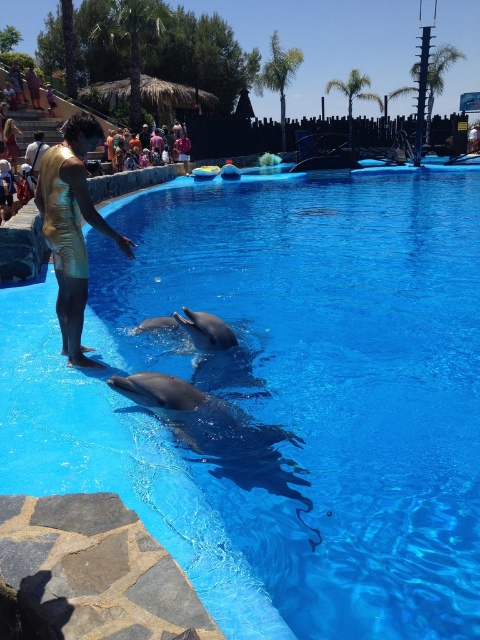
The height and width of the screenshot is (640, 480). What do you see at coordinates (216, 353) in the screenshot?
I see `gray smooth dolphin at center` at bounding box center [216, 353].

In the scene shown: Who is shorter, gray smooth dolphin at center or multicolored fabric crowd at upper center?

gray smooth dolphin at center

You are a GUI agent. You are given a task and a screenshot of the screen. Output one action in this format:
    pyautogui.click(x=<x>, y=<y>)
    Task: Click on the gray smooth dolphin at center
    This screenshot has width=480, height=640.
    Given the screenshot: What is the action you would take?
    pyautogui.click(x=216, y=353)

The width and height of the screenshot is (480, 640). What do you see at coordinates (148, 144) in the screenshot?
I see `multicolored fabric crowd at upper center` at bounding box center [148, 144].

Which is more to the left, multicolored fabric crowd at upper center or golden fabric dress at lower left?

From the viewer's perspective, golden fabric dress at lower left appears more on the left side.

Between point (190, 145) and point (11, 122), which one is positioned in front?

Point (11, 122) is more forward.

I want to click on multicolored fabric crowd at upper center, so click(x=148, y=144).

Is gray smooth dolphin at lower center taller than smooth gray dolphin at center?

Correct, gray smooth dolphin at lower center is much taller as smooth gray dolphin at center.

Is the position of gray smooth dolphin at lower center more distant than that of smooth gray dolphin at center?

That is False.

You are a GUI agent. You are given a task and a screenshot of the screen. Output one action in this format:
    pyautogui.click(x=<x>, y=<y>)
    Task: Click on the gray smooth dolphin at lower center
    
    Given the screenshot: What is the action you would take?
    pyautogui.click(x=212, y=428)